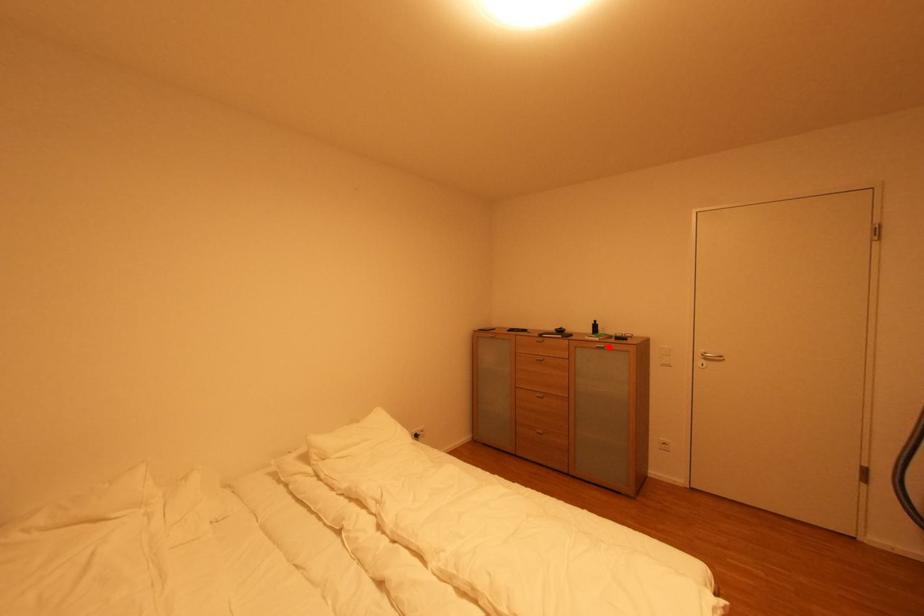
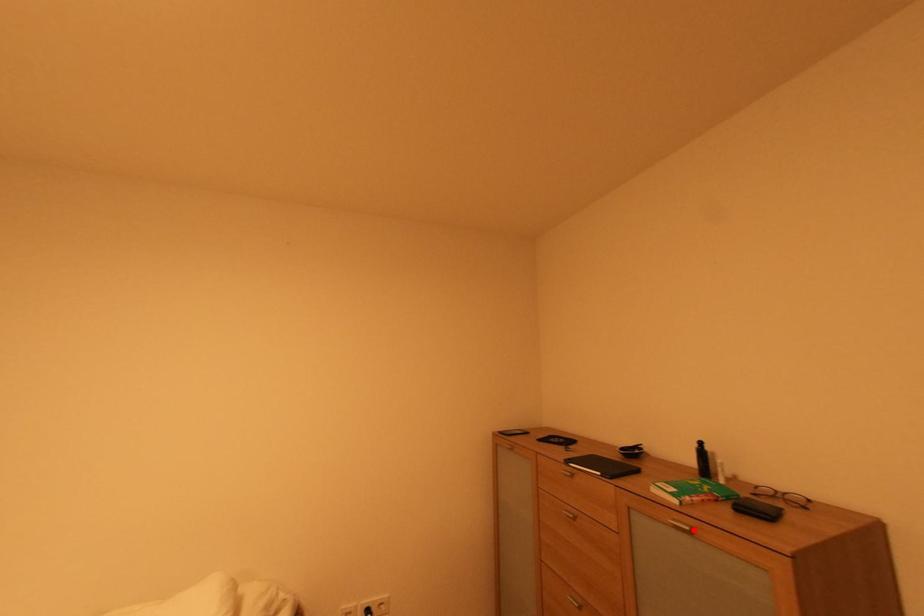
I am providing you with two images of the same scene from different viewpoints. A red point is marked on the first image and another point is marked on the second image. Is the red point in image1 aligned with the point shown in image2?

Yes